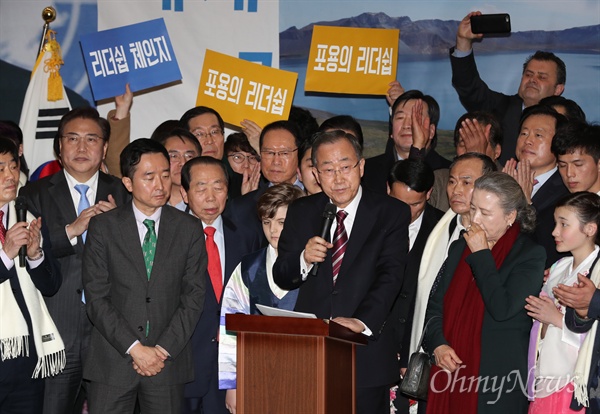
Locate an element on the screen. podium is located at coordinates (304, 375).